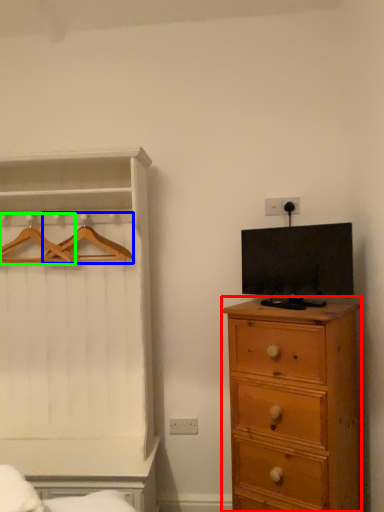
Question: Considering the real-world distances, which object is closest to chest of drawers (highlighted by a red box)? hanger (highlighted by a blue box) or hanger (highlighted by a green box).

Choices:
 (A) hanger
 (B) hanger

Answer: (A)